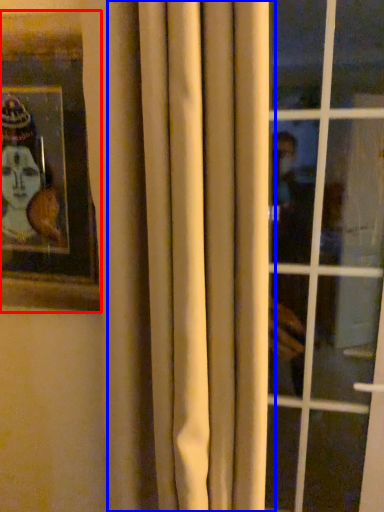
Question: Which point is closer to the camera, picture frame (highlighted by a red box) or curtain (highlighted by a blue box)?

Choices:
 (A) picture frame
 (B) curtain

Answer: (B)